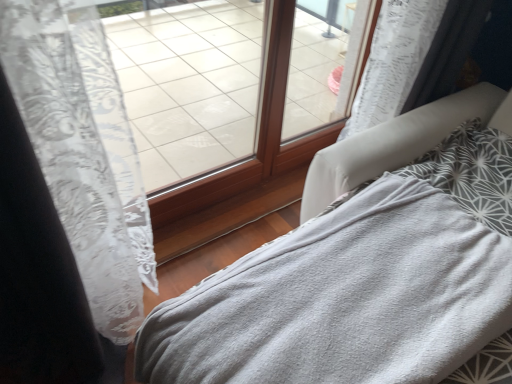
Question: From the image's perspective, is gray soft blanket at lower right located above transparent glass window at center, the 2th window from the left?

Choices:
 (A) yes
 (B) no

Answer: (B)

Question: Is gray soft blanket at lower right not near transparent glass window at center, arranged as the first window when viewed from the right?

Choices:
 (A) yes
 (B) no

Answer: (B)

Question: Can you confirm if gray soft blanket at lower right is wider than transparent glass window at center, the 2th window from the left?

Choices:
 (A) yes
 (B) no

Answer: (A)

Question: Is gray soft blanket at lower right outside of transparent glass window at center, arranged as the first window when viewed from the right?

Choices:
 (A) yes
 (B) no

Answer: (A)

Question: Is gray soft blanket at lower right further to the viewer compared to transparent glass window at center, the 2th window from the left?

Choices:
 (A) yes
 (B) no

Answer: (B)

Question: In terms of height, does transparent glass window at center, the 2th window from the left, look taller or shorter compared to gray soft blanket at lower right?

Choices:
 (A) short
 (B) tall

Answer: (B)

Question: Would you say transparent glass window at center, arranged as the first window when viewed from the right, is inside or outside gray soft blanket at lower right?

Choices:
 (A) outside
 (B) inside

Answer: (A)

Question: Based on their sizes in the image, would you say transparent glass window at center, the 2th window from the left, is bigger or smaller than gray soft blanket at lower right?

Choices:
 (A) small
 (B) big

Answer: (A)

Question: Does point pos(305,122) appear closer or farther from the camera than point pos(389,147)?

Choices:
 (A) farther
 (B) closer

Answer: (A)

Question: Choose the correct answer: Is gray soft blanket at lower right inside transparent glass window at center, the 2th window from the left, or outside it?

Choices:
 (A) outside
 (B) inside

Answer: (A)

Question: Is gray soft blanket at lower right to the left or to the right of transparent glass window at center, arranged as the first window when viewed from the right, in the image?

Choices:
 (A) left
 (B) right

Answer: (A)

Question: Is gray soft blanket at lower right in front of or behind transparent glass window at center, arranged as the first window when viewed from the right, in the image?

Choices:
 (A) front
 (B) behind

Answer: (A)

Question: From a real-world perspective, relative to transparent glass window at center, arranged as the first window when viewed from the right, is gray soft blanket at lower right vertically above or below?

Choices:
 (A) above
 (B) below

Answer: (B)

Question: Would you say gray soft blanket at lower right is to the left or to the right of transparent glass window at center, placed as the second window when sorted from right to left, in the picture?

Choices:
 (A) right
 (B) left

Answer: (A)

Question: In terms of width, does gray soft blanket at lower right look wider or thinner when compared to transparent glass window at center, acting as the first window starting from the left?

Choices:
 (A) thin
 (B) wide

Answer: (B)